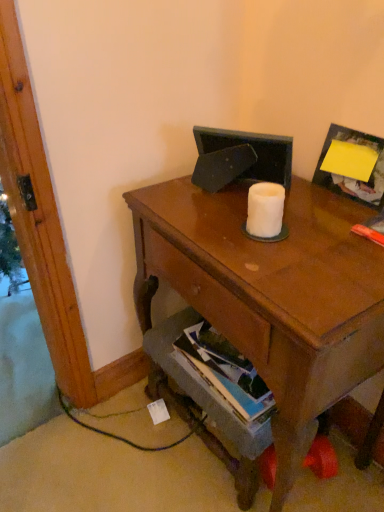
Question: From a real-world perspective, is hardcover book at lower center on top of white matte toilet paper at center?

Choices:
 (A) yes
 (B) no

Answer: (B)

Question: Could you tell me if hardcover book at lower center is turned towards white matte toilet paper at center?

Choices:
 (A) no
 (B) yes

Answer: (A)

Question: Can you confirm if hardcover book at lower center is smaller than white matte toilet paper at center?

Choices:
 (A) yes
 (B) no

Answer: (B)

Question: Does hardcover book at lower center appear on the right side of white matte toilet paper at center?

Choices:
 (A) yes
 (B) no

Answer: (B)

Question: Considering the relative sizes of hardcover book at lower center and white matte toilet paper at center in the image provided, is hardcover book at lower center wider than white matte toilet paper at center?

Choices:
 (A) no
 (B) yes

Answer: (B)

Question: From a real-world perspective, relative to yellow paper at upper right, is matte brown desk at center vertically above or below?

Choices:
 (A) below
 (B) above

Answer: (A)

Question: In terms of height, does matte brown desk at center look taller or shorter compared to yellow paper at upper right?

Choices:
 (A) tall
 (B) short

Answer: (A)

Question: Considering the positions of matte brown desk at center and yellow paper at upper right in the image, is matte brown desk at center bigger or smaller than yellow paper at upper right?

Choices:
 (A) small
 (B) big

Answer: (B)

Question: Considering the positions of matte brown desk at center and yellow paper at upper right in the image, is matte brown desk at center wider or thinner than yellow paper at upper right?

Choices:
 (A) thin
 (B) wide

Answer: (B)

Question: From the image's perspective, relative to white matte toilet paper at center, is yellow paper at upper right above or below?

Choices:
 (A) below
 (B) above

Answer: (B)

Question: Considering the positions of yellow paper at upper right and white matte toilet paper at center in the image, is yellow paper at upper right taller or shorter than white matte toilet paper at center?

Choices:
 (A) tall
 (B) short

Answer: (A)

Question: Based on their positions, is yellow paper at upper right located to the left or right of white matte toilet paper at center?

Choices:
 (A) left
 (B) right

Answer: (B)

Question: Is point (347, 139) closer or farther from the camera than point (249, 231)?

Choices:
 (A) closer
 (B) farther

Answer: (B)

Question: From a real-world perspective, relative to hardcover book at lower center, is white matte toilet paper at center vertically above or below?

Choices:
 (A) above
 (B) below

Answer: (A)

Question: Do you think white matte toilet paper at center is within hardcover book at lower center, or outside of it?

Choices:
 (A) inside
 (B) outside

Answer: (B)